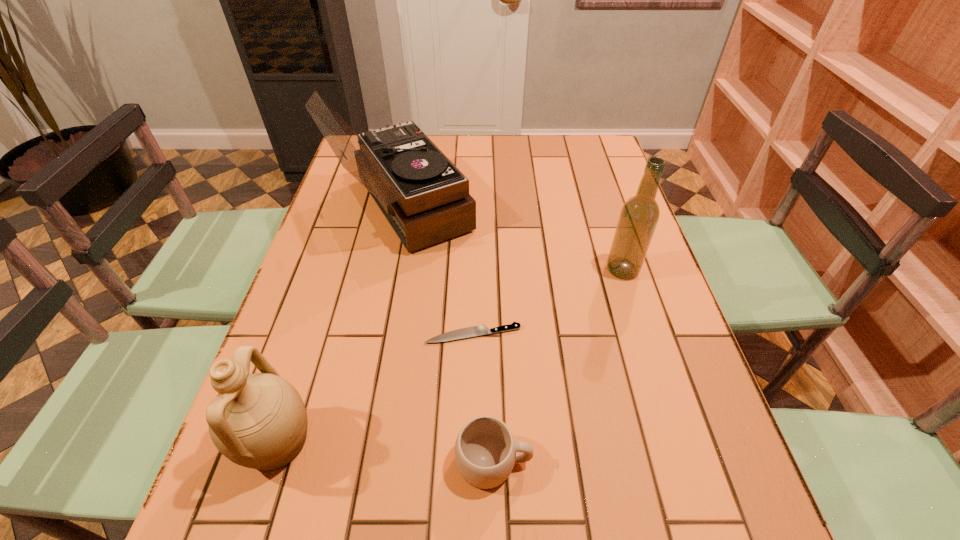
At what (x,y) coordinates should I click in order to perform the action: click on vacant area at the far right corner. Please return your answer as a coordinate pair (x, y). Image resolution: width=960 pixels, height=540 pixels. Looking at the image, I should click on (606, 161).

Where is `free space between the second shortest object and the rightmost object`? free space between the second shortest object and the rightmost object is located at coordinates (558, 366).

Find the location of `free area in between the shortest object and the third tallest object`. free area in between the shortest object and the third tallest object is located at coordinates (374, 388).

Where is `empty location between the third shortest object and the rightmost object`? empty location between the third shortest object and the rightmost object is located at coordinates (449, 356).

Where is `vacant area that lies between the second shortest object and the liquor`? The width and height of the screenshot is (960, 540). vacant area that lies between the second shortest object and the liquor is located at coordinates (558, 366).

Locate an element on the screen. The height and width of the screenshot is (540, 960). free area in between the steak knife and the record player is located at coordinates (437, 271).

Image resolution: width=960 pixels, height=540 pixels. In order to click on free space between the record player and the pitcher in this screenshot , I will do `click(339, 325)`.

Locate an element on the screen. The image size is (960, 540). free spot between the record player and the rightmost object is located at coordinates (512, 238).

Identify the location of vacant point located between the rightmost object and the record player. (512, 238).

This screenshot has width=960, height=540. Identify the location of free spot between the shortest object and the record player. (437, 271).